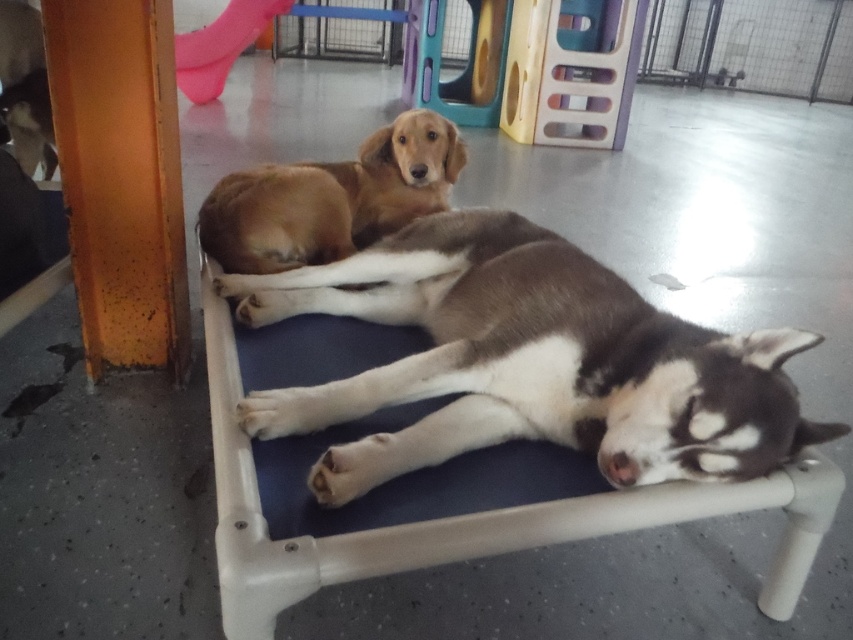
Between brown fur dog at center and golden brown fur at center, which one is positioned higher?

Positioned higher is golden brown fur at center.

Is brown fur dog at center above golden brown fur at center?

Actually, brown fur dog at center is below golden brown fur at center.

Between point (248, 403) and point (277, 189), which one is positioned in front?

Point (248, 403) is in front.

In order to click on brown fur dog at center in this screenshot , I will do `click(526, 362)`.